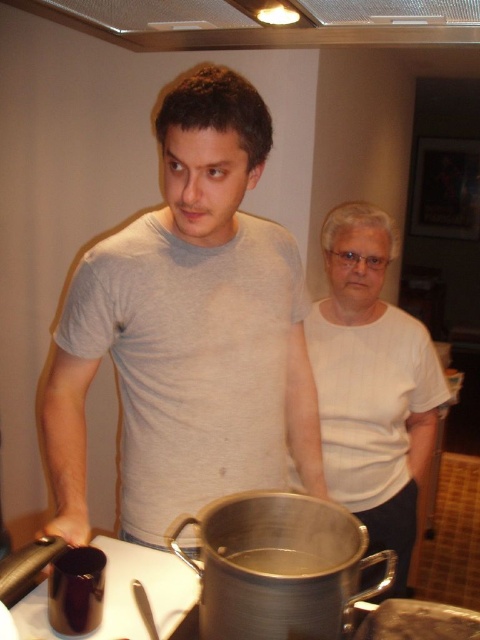
Question: Can you confirm if white matte shirt at center is wider than metallic silver pot at center?

Choices:
 (A) no
 (B) yes

Answer: (B)

Question: Estimate the real-world distances between objects in this image. Which object is closer to the metallic silver pot at center?

Choices:
 (A) white matte shirt at center
 (B) gray matte t-shirt at center

Answer: (B)

Question: Among these points, which one is nearest to the camera?

Choices:
 (A) (310, 566)
 (B) (164, 445)

Answer: (A)

Question: Which of these objects is positioned closest to the white matte shirt at center?

Choices:
 (A) metallic silver pot at center
 (B) gray matte t-shirt at center

Answer: (B)

Question: Can you confirm if gray matte t-shirt at center is positioned to the left of white matte shirt at center?

Choices:
 (A) no
 (B) yes

Answer: (B)

Question: Can you confirm if gray matte t-shirt at center is positioned to the left of white matte shirt at center?

Choices:
 (A) no
 (B) yes

Answer: (B)